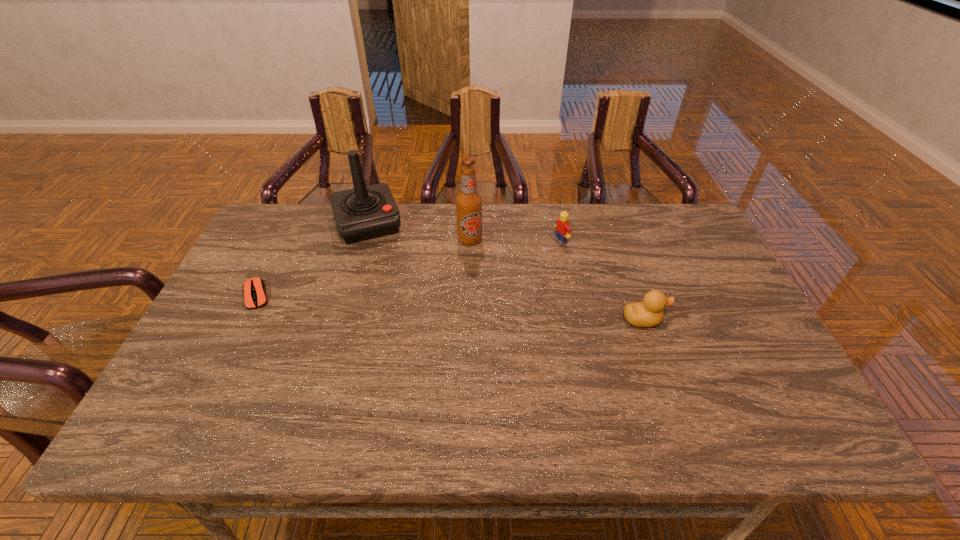
This screenshot has width=960, height=540. In order to click on vacant area that lies between the shortest object and the beer bottle in this screenshot , I will do `click(363, 268)`.

Identify the location of empty space between the joystick and the duckling. (506, 272).

The image size is (960, 540). I want to click on empty location between the Lego and the leftmost object, so (409, 268).

I want to click on free space between the leftmost object and the joystick, so click(312, 260).

Identify the location of object that is the closest to the shortest object. The height and width of the screenshot is (540, 960). (365, 212).

Where is `object that can be found as the second closest to the duckling`? The image size is (960, 540). object that can be found as the second closest to the duckling is located at coordinates (469, 202).

What are the coordinates of `free space that satisfies the following two spatial constraints: 1. on the front side of the duckling; 2. on the face of the fourth object from right to left` in the screenshot? It's located at (339, 320).

I want to click on free spot that satisfies the following two spatial constraints: 1. on the front side of the third object from right to left; 2. on the face of the duckling, so coord(468,320).

Locate an element on the screen. This screenshot has width=960, height=540. blank space that satisfies the following two spatial constraints: 1. on the front side of the third object from right to left; 2. on the face of the rightmost object is located at coordinates (468, 320).

Find the location of `blank space that satisfies the following two spatial constraints: 1. on the back side of the leftmost object; 2. on the left side of the fourth object from right to left`. blank space that satisfies the following two spatial constraints: 1. on the back side of the leftmost object; 2. on the left side of the fourth object from right to left is located at coordinates [x=293, y=224].